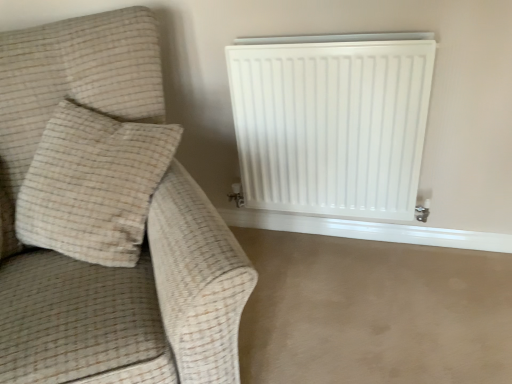
Question: Is white matte radiator at upper right further to the viewer compared to beige carpet at lower right?

Choices:
 (A) yes
 (B) no

Answer: (A)

Question: Considering the relative sizes of white matte radiator at upper right and beige carpet at lower right in the image provided, is white matte radiator at upper right smaller than beige carpet at lower right?

Choices:
 (A) yes
 (B) no

Answer: (A)

Question: Considering the relative sizes of white matte radiator at upper right and beige carpet at lower right in the image provided, is white matte radiator at upper right shorter than beige carpet at lower right?

Choices:
 (A) no
 (B) yes

Answer: (A)

Question: Does white matte radiator at upper right have a greater height compared to beige carpet at lower right?

Choices:
 (A) yes
 (B) no

Answer: (A)

Question: Is white matte radiator at upper right aimed at beige carpet at lower right?

Choices:
 (A) no
 (B) yes

Answer: (A)

Question: Is white matte radiator at upper right to the left of beige carpet at lower right from the viewer's perspective?

Choices:
 (A) no
 (B) yes

Answer: (B)

Question: From the image's perspective, does beige fabric couch at left appear lower than white matte radiator at upper right?

Choices:
 (A) yes
 (B) no

Answer: (A)

Question: Is beige fabric couch at left surrounding white matte radiator at upper right?

Choices:
 (A) no
 (B) yes

Answer: (A)

Question: Is beige fabric couch at left wider than white matte radiator at upper right?

Choices:
 (A) yes
 (B) no

Answer: (A)

Question: Is beige fabric couch at left positioned beyond the bounds of white matte radiator at upper right?

Choices:
 (A) no
 (B) yes

Answer: (B)

Question: Does beige fabric couch at left have a smaller size compared to white matte radiator at upper right?

Choices:
 (A) no
 (B) yes

Answer: (A)

Question: Is beige fabric couch at left aimed at white matte radiator at upper right?

Choices:
 (A) no
 (B) yes

Answer: (A)

Question: Is beige textured pillow at left positioned in front of beige fabric couch at left?

Choices:
 (A) yes
 (B) no

Answer: (B)